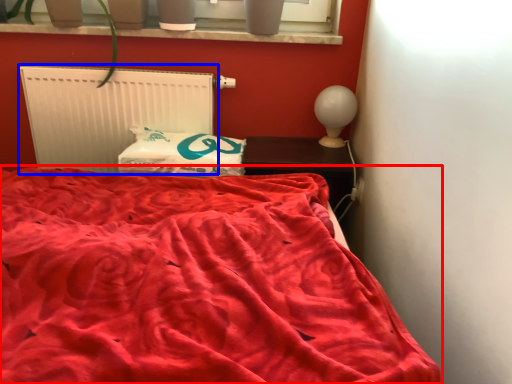
Question: Which object is closer to the camera taking this photo, bed (highlighted by a red box) or radiator (highlighted by a blue box)?

Choices:
 (A) bed
 (B) radiator

Answer: (A)